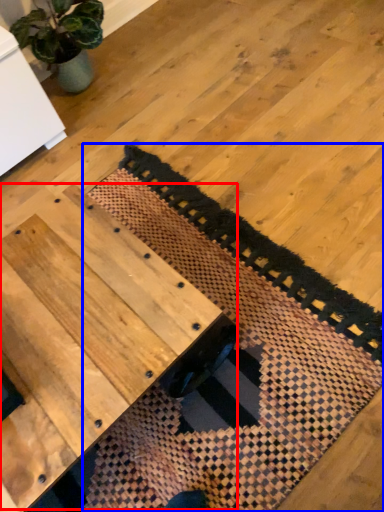
Question: Among these objects, which one is farthest to the camera, table (highlighted by a red box) or mat (highlighted by a blue box)?

Choices:
 (A) table
 (B) mat

Answer: (B)